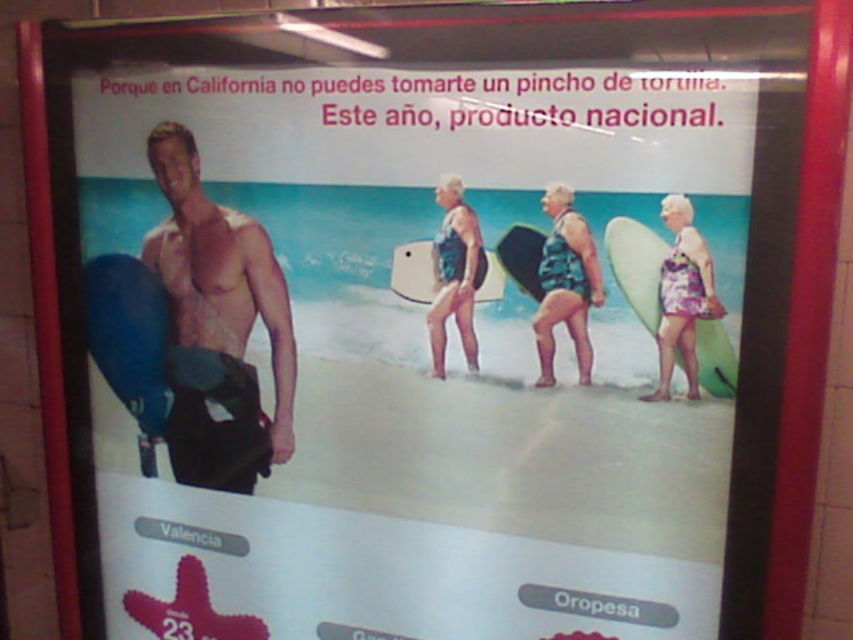
Question: Estimate the real-world distances between objects in this image. Which object is closer to the blue matte surfboard at left?

Choices:
 (A) camouflage-patterned surfboard at center
 (B) green matte surfboard at right

Answer: (A)

Question: Which of the following is the farthest from the observer?

Choices:
 (A) (194, 410)
 (B) (115, 266)
 (C) (473, 243)
 (D) (497, 246)

Answer: (B)

Question: Which point is farther to the camera?

Choices:
 (A) camouflage-patterned surfboard at center
 (B) blue matte surfboard at left
 (C) black matte surfboard at center

Answer: (B)

Question: Is white foam surfboard at center smaller than black matte surfboard at center?

Choices:
 (A) yes
 (B) no

Answer: (B)

Question: Where is black matte surfboard at center located in relation to camouflage-patterned surfboard at center in the image?

Choices:
 (A) above
 (B) below

Answer: (B)

Question: Observing the image, what is the correct spatial positioning of white foam surfboard at center in reference to camouflage-patterned surfboard at center?

Choices:
 (A) left
 (B) right

Answer: (A)